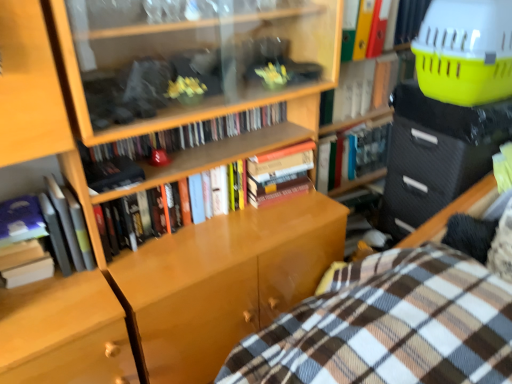
Question: Considering the relative sizes of hardcover book at center, marked as the 6th book in a right-to-left arrangement, and hardcover book at left, acting as the 7th book starting from the right, in the image provided, is hardcover book at center, marked as the 6th book in a right-to-left arrangement, shorter than hardcover book at left, acting as the 7th book starting from the right,?

Choices:
 (A) no
 (B) yes

Answer: (B)

Question: Is hardcover book at center, marked as the 6th book in a right-to-left arrangement, at the left side of hardcover book at left, acting as the 7th book starting from the right?

Choices:
 (A) yes
 (B) no

Answer: (B)

Question: Is hardcover book at center, marked as the 6th book in a right-to-left arrangement, taller than hardcover book at left, which is the second book in left-to-right order?

Choices:
 (A) yes
 (B) no

Answer: (B)

Question: From the image's perspective, would you say hardcover book at center, which appears as the third book when viewed from the left, is positioned over hardcover book at left, acting as the 7th book starting from the right?

Choices:
 (A) yes
 (B) no

Answer: (A)

Question: Is hardcover book at center, which appears as the third book when viewed from the left, with hardcover book at left, which is the second book in left-to-right order?

Choices:
 (A) yes
 (B) no

Answer: (B)

Question: Is point (460, 374) positioned closer to the camera than point (57, 208)?

Choices:
 (A) farther
 (B) closer

Answer: (B)

Question: Considering the positions of plaid fabric bed at lower right and hardcover book at left, which is the second book in left-to-right order, in the image, is plaid fabric bed at lower right wider or thinner than hardcover book at left, which is the second book in left-to-right order,?

Choices:
 (A) thin
 (B) wide

Answer: (B)

Question: In the image, is plaid fabric bed at lower right positioned in front of or behind hardcover book at left, which is the second book in left-to-right order?

Choices:
 (A) behind
 (B) front

Answer: (B)

Question: From a real-world perspective, is plaid fabric bed at lower right physically located above or below hardcover book at left, which is the second book in left-to-right order?

Choices:
 (A) below
 (B) above

Answer: (A)

Question: Does point (29, 233) appear closer or farther from the camera than point (370, 150)?

Choices:
 (A) farther
 (B) closer

Answer: (B)

Question: Would you say hardcover book at left, the eighth book from the right, is to the left or to the right of hardcover book at center, which is counted as the 3th book, starting from the right, in the picture?

Choices:
 (A) right
 (B) left

Answer: (B)

Question: From a real-world perspective, relative to hardcover book at center, positioned as the sixth book in left-to-right order, is hardcover book at left, acting as the first book starting from the left, vertically above or below?

Choices:
 (A) below
 (B) above

Answer: (B)

Question: From the image's perspective, relative to hardcover book at center, which is counted as the 3th book, starting from the right, is hardcover book at left, acting as the first book starting from the left, above or below?

Choices:
 (A) below
 (B) above

Answer: (A)

Question: Would you say matte black bookshelf at upper center, positioned as the 5th book in right-to-left order, is inside or outside hardcover book at upper center, the seventh book in the left-to-right sequence?

Choices:
 (A) inside
 (B) outside

Answer: (B)

Question: Considering the positions of matte black bookshelf at upper center, positioned as the 5th book in right-to-left order, and hardcover book at upper center, positioned as the 2th book in right-to-left order, in the image, is matte black bookshelf at upper center, positioned as the 5th book in right-to-left order, bigger or smaller than hardcover book at upper center, positioned as the 2th book in right-to-left order,?

Choices:
 (A) small
 (B) big

Answer: (A)